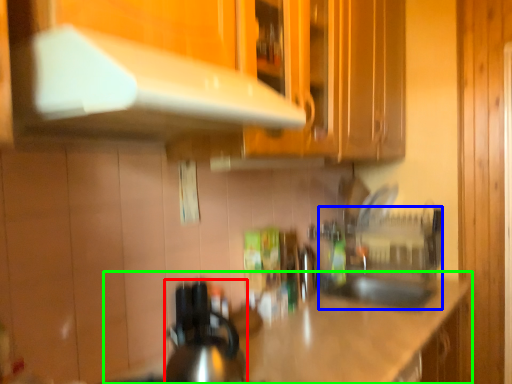
Question: Considering the real-world distances, which object is closest to kitchen appliance (highlighted by a red box)? sink (highlighted by a blue box) or countertop (highlighted by a green box).

Choices:
 (A) sink
 (B) countertop

Answer: (B)